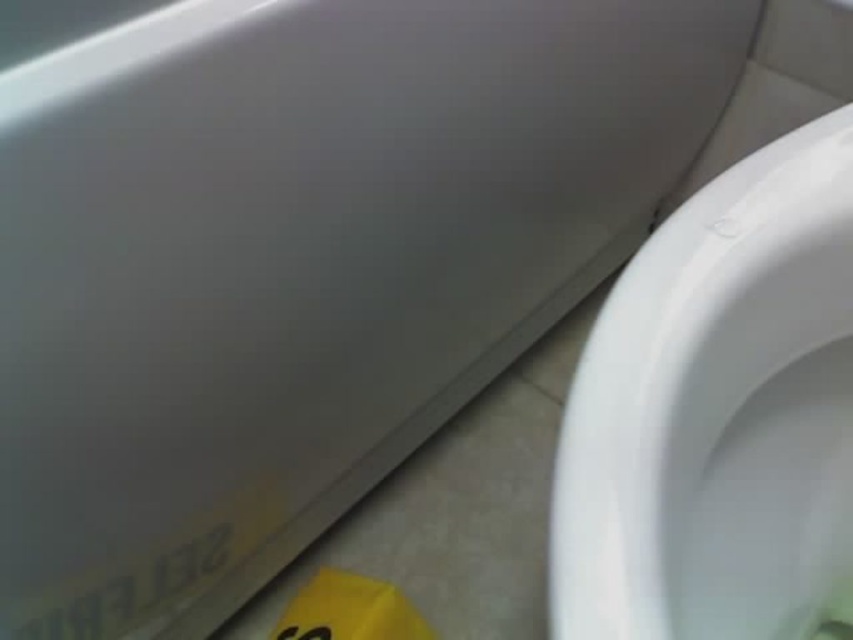
Question: Can you confirm if white glossy toilet bowl at right is positioned to the right of yellow paper at lower left?

Choices:
 (A) no
 (B) yes

Answer: (B)

Question: Can you confirm if white glossy toilet bowl at right is smaller than yellow paper at lower left?

Choices:
 (A) yes
 (B) no

Answer: (B)

Question: Can you confirm if white glossy toilet bowl at right is positioned to the left of yellow paper at lower left?

Choices:
 (A) no
 (B) yes

Answer: (A)